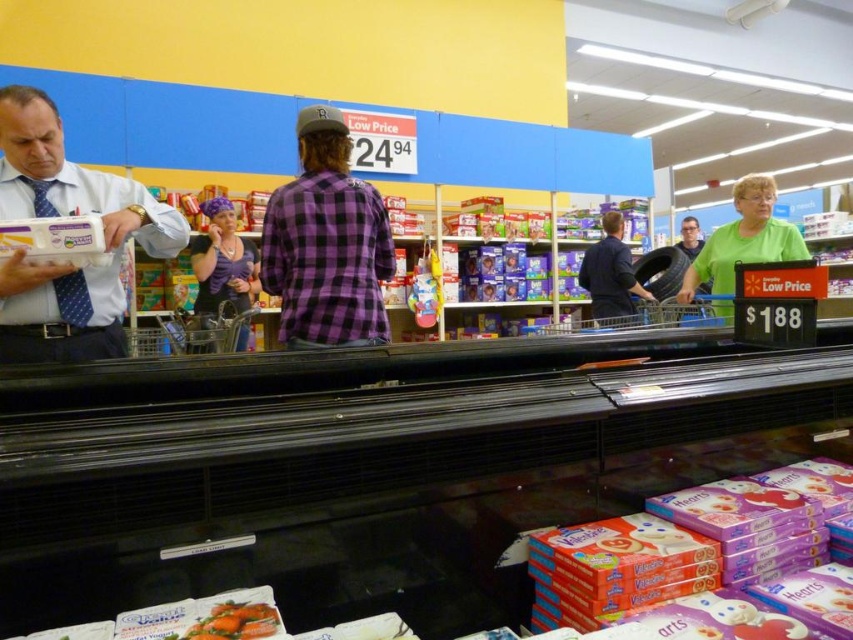
You are a customer in the supermarket and want to grab the smooth orange carrots at lower left. Which direction should you move relative to the purple plaid shirt at center?

You should move to the left of the purple plaid shirt at center to reach the smooth orange carrots at lower left since the purple plaid shirt at center is to the right of smooth orange carrots at lower left.

You are a store employee trying to arrange items on a shelf. You have a purple plaid shirt at center and smooth orange carrots at lower left. Which item requires a wider space for placement?

The purple plaid shirt at center requires a wider space for placement since its width surpasses that of the smooth orange carrots at lower left.

You are a customer in the supermarket and you want to reach the rubber tire at center. There is a person wearing a green matte shirt at upper right blocking your path. Can you walk around them?

The green matte shirt at upper right is shorter than the rubber tire at center. Since the person is shorter than the tire, you can walk around them as they are not blocking the entire path.